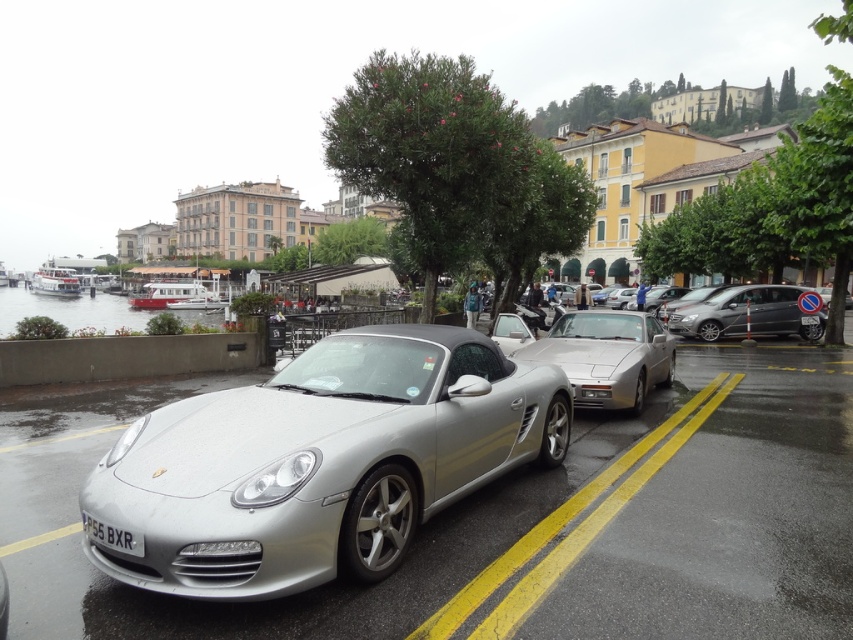
Can you confirm if silver metallic sports car at center is smaller than black plastic license plate at lower center?

Actually, silver metallic sports car at center might be larger than black plastic license plate at lower center.

Between silver metallic sports car at center and black plastic license plate at lower center, which one has less height?

black plastic license plate at lower center

Which is behind, point (640, 390) or point (143, 544)?

Positioned behind is point (640, 390).

I want to click on silver metallic sports car at center, so pos(607,356).

Is silver metallic convertible at center taller than black plastic license plate at lower center?

Yes, silver metallic convertible at center is taller than black plastic license plate at lower center.

Does silver metallic convertible at center have a lesser height compared to black plastic license plate at lower center?

No, silver metallic convertible at center is not shorter than black plastic license plate at lower center.

Measure the distance between point (254, 532) and camera.

Point (254, 532) and camera are 3.13 meters apart from each other.

Where is `silver metallic convertible at center`? The height and width of the screenshot is (640, 853). silver metallic convertible at center is located at coordinates [321, 461].

Between silver metallic sports car at center and metallic silver minivan at right, which one has more height?

metallic silver minivan at right

What do you see at coordinates (607, 356) in the screenshot?
I see `silver metallic sports car at center` at bounding box center [607, 356].

Locate an element on the screen. silver metallic sports car at center is located at coordinates (607, 356).